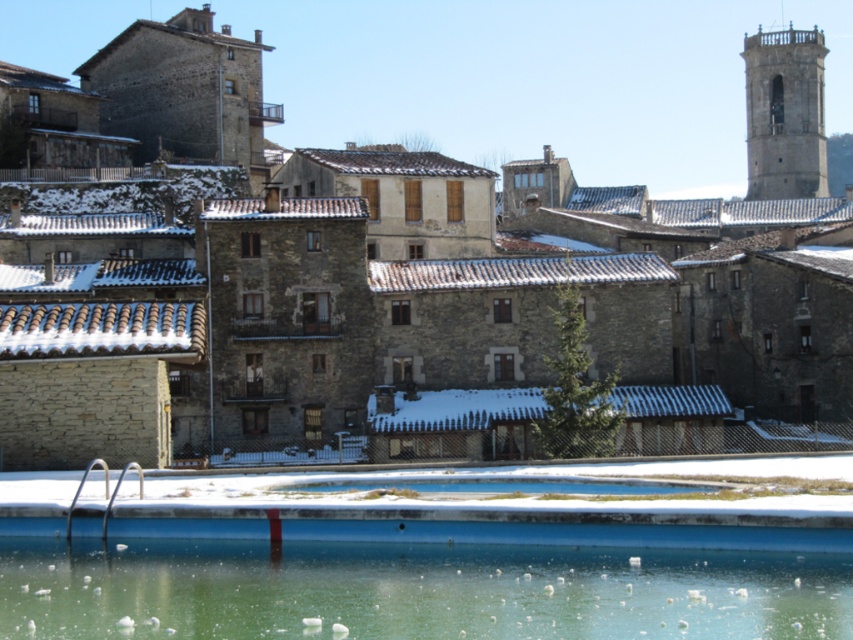
Does point (531, 596) come behind point (747, 115)?

No, (531, 596) is in front of (747, 115).

Which is behind, point (830, 561) or point (772, 54)?

Point (772, 54)

Between point (416, 580) and point (764, 56), which one is positioned in front?

Positioned in front is point (416, 580).

You are a GUI agent. You are given a task and a screenshot of the screen. Output one action in this format:
    pyautogui.click(x=<x>, y=<y>)
    Task: Click on the blue concrete pool at lower center
    This screenshot has width=853, height=640.
    Given the screenshot: What is the action you would take?
    pyautogui.click(x=413, y=588)

Consider the image. Is stone buildings at center closer to the viewer compared to blue concrete pool at lower center?

No, stone buildings at center is further to the viewer.

Can you confirm if stone buildings at center is shorter than blue concrete pool at lower center?

No, stone buildings at center is not shorter than blue concrete pool at lower center.

Identify the location of stone buildings at center. The height and width of the screenshot is (640, 853). (537, 81).

In order to click on stone buildings at center in this screenshot , I will do `click(537, 81)`.

Which is more to the left, stone buildings at center or gray stone tower at upper right?

Positioned to the left is stone buildings at center.

Consider the image. Is stone buildings at center bigger than gray stone tower at upper right?

Yes, stone buildings at center is bigger than gray stone tower at upper right.

Which is behind, point (337, 106) or point (822, 115)?

The point (337, 106) is behind.

The width and height of the screenshot is (853, 640). What are the coordinates of `stone buildings at center` in the screenshot? It's located at coord(537,81).